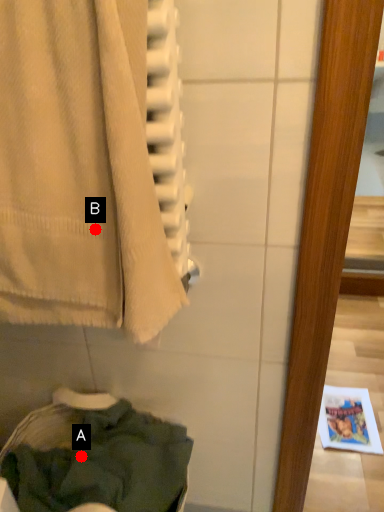
Question: Two points are circled on the image, labeled by A and B beside each circle. Which point appears closest to the camera in this image?

Choices:
 (A) A is closer
 (B) B is closer

Answer: (B)